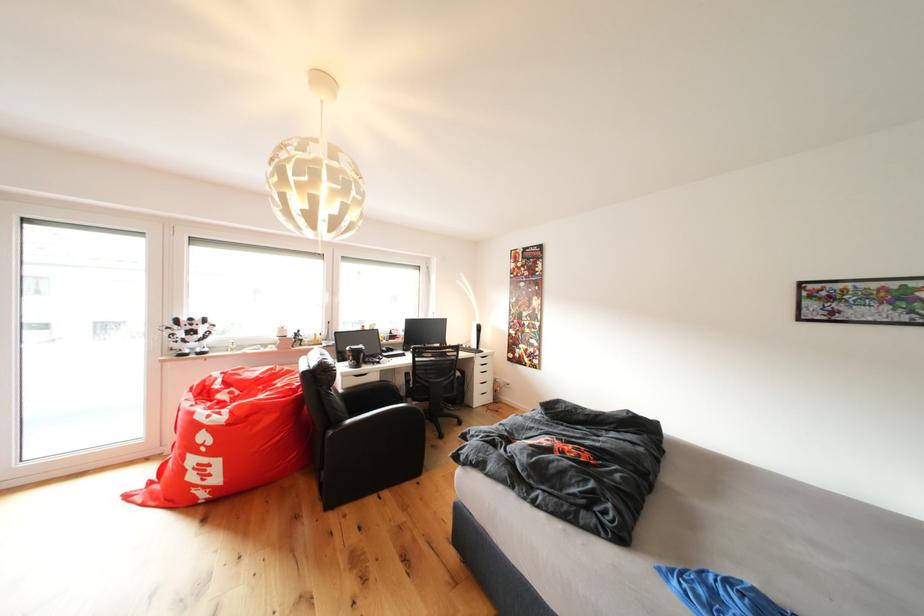
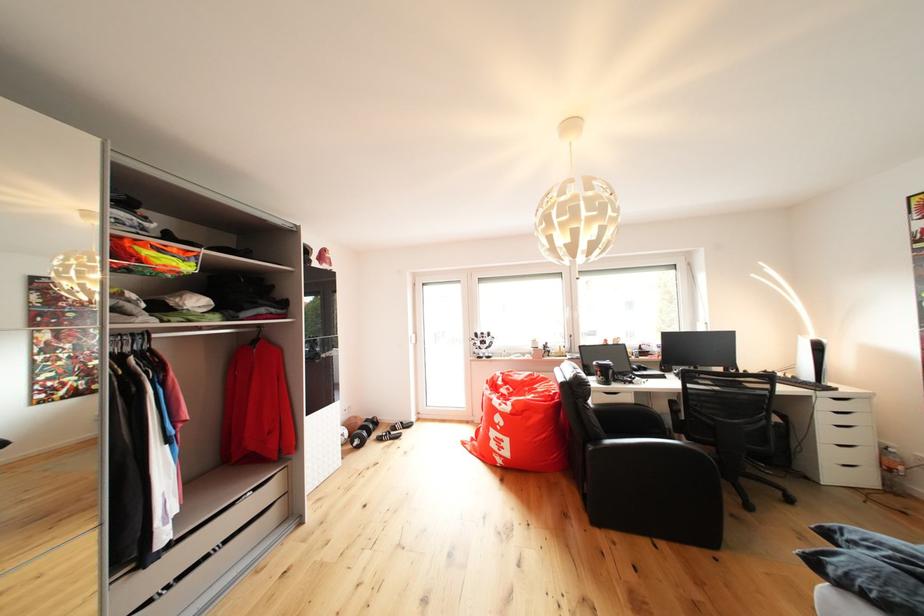
Where in the second image is the point corresponding to [392,377] from the first image?

(647, 399)